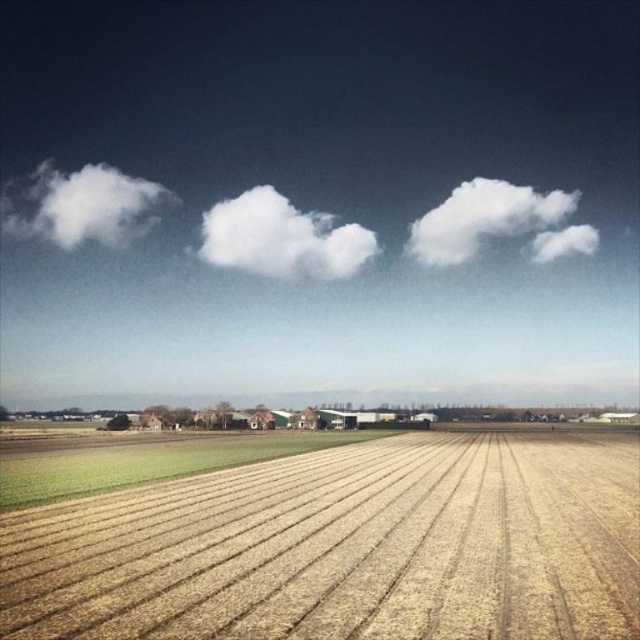
Does golden textured wheat field at center appear over white fluffy cloud at upper left?

Actually, golden textured wheat field at center is below white fluffy cloud at upper left.

Is point (202, 580) closer to viewer compared to point (116, 218)?

Yes, point (202, 580) is closer to viewer.

Does point (582, 496) lie in front of point (97, 173)?

Yes, point (582, 496) is in front of point (97, 173).

Locate an element on the screen. The image size is (640, 640). golden textured wheat field at center is located at coordinates (342, 547).

Who is more distant from viewer, (412, 547) or (92, 468)?

Point (92, 468)

Looking at this image, can you confirm if golden textured wheat field at center is positioned to the left of green grassy field at lower left?

Incorrect, golden textured wheat field at center is not on the left side of green grassy field at lower left.

At what (x,y) coordinates should I click in order to perform the action: click on golden textured wheat field at center. Please return your answer as a coordinate pair (x, y). The width and height of the screenshot is (640, 640). Looking at the image, I should click on (342, 547).

Image resolution: width=640 pixels, height=640 pixels. I want to click on golden textured wheat field at center, so click(342, 547).

Does point (6, 504) lie behind point (534, 237)?

No, it is not.

Does green grassy field at lower left have a greater width compared to white fluffy cloud at upper center?

No.

Identify the location of green grassy field at lower left. (147, 461).